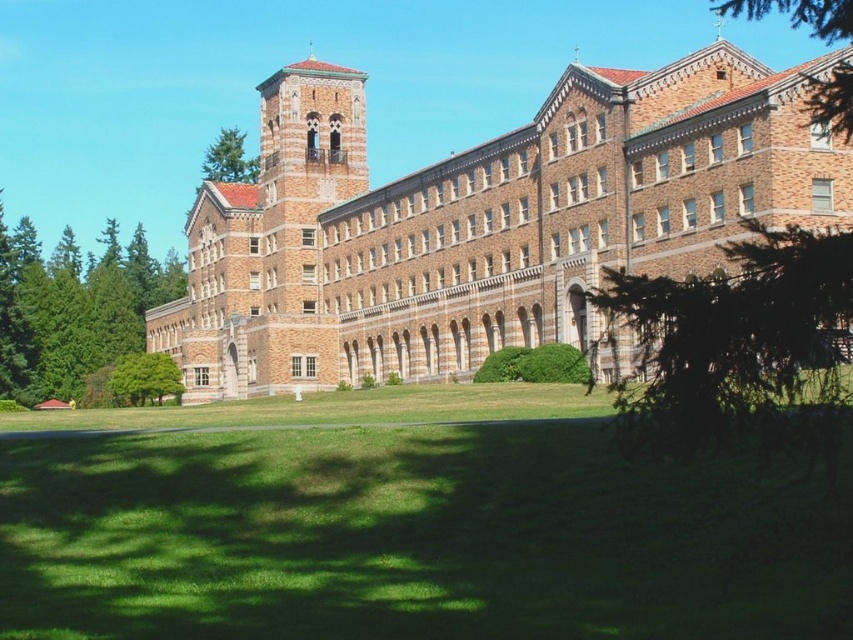
What do you see at coordinates (737, 342) in the screenshot?
I see `green leafy tree at center` at bounding box center [737, 342].

Is green leafy tree at center above green leafy tree at lower left?

Correct, green leafy tree at center is located above green leafy tree at lower left.

Is point (804, 301) less distant than point (154, 358)?

Yes, point (804, 301) is closer to viewer.

What are the coordinates of `green leafy tree at center` in the screenshot? It's located at (737, 342).

Who is shorter, green leafy tree at left or green leafy tree at upper center?

Standing shorter between the two is green leafy tree at upper center.

Who is lower down, green leafy tree at left or green leafy tree at upper center?

green leafy tree at left is below.

Where is `green leafy tree at left`? green leafy tree at left is located at coordinates (73, 307).

Locate an element on the screen. The width and height of the screenshot is (853, 640). green leafy tree at left is located at coordinates (73, 307).

Which is below, green leafy tree at center or green leafy tree at upper right?

Positioned lower is green leafy tree at center.

Who is positioned more to the right, green leafy tree at center or green leafy tree at upper right?

Positioned to the right is green leafy tree at upper right.

Where is `green leafy tree at center`? The width and height of the screenshot is (853, 640). green leafy tree at center is located at coordinates (737, 342).

The width and height of the screenshot is (853, 640). Identify the location of green leafy tree at center. (737, 342).